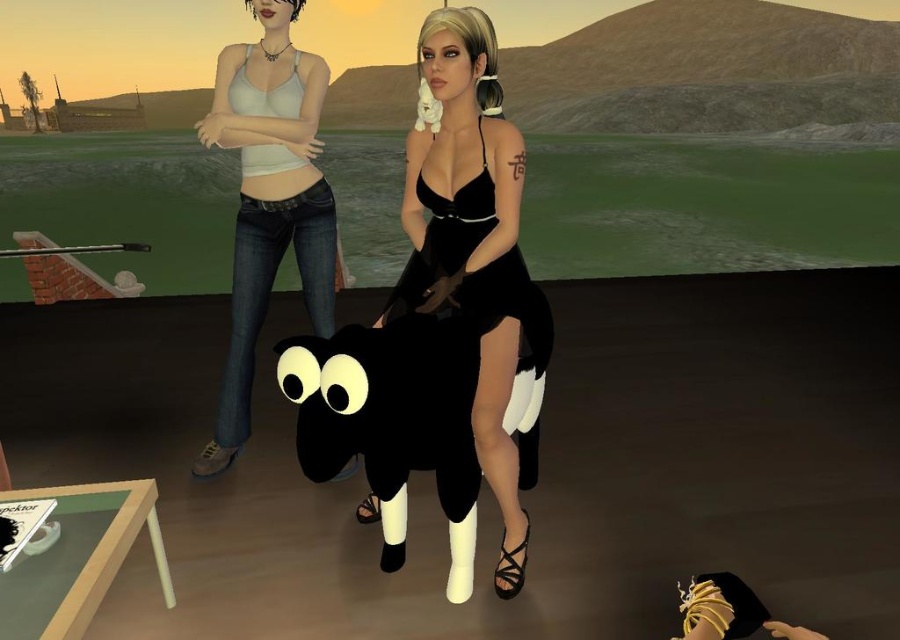
You are a fashion designer observing a model wearing two dresses in the center of the scene. The dresses are the velvet black dress at center and the black satin dress at center. Which dress is farther to the right?

The velvet black dress at center and black satin dress at center are 2.96 inches apart, but the exact positioning isn not specified in the description. Therefore, it is impossible to determine which dress is farther to the right based on the provided information.

You are a game developer designing a virtual environment. In the scene provided, where is the velvet black dress at center positioned relative to the coordinate system? Please provide the coordinates mentioned in the description.

The velvet black dress at center is located at point coordinates of (474, 250).

You are a photographer standing in the scene wanting to take a photo of the matte white tank top at center without the black matte plush sheep at center blocking it. Is this possible?

The black matte plush sheep at center is in front of the matte white tank top at center, so it is blocking the view. To take a photo of the matte white tank top at center without the sheep blocking it, you would need to move around the sheep to a position where the tank top is visible behind it or reposition the sheep so it is no longer in front.